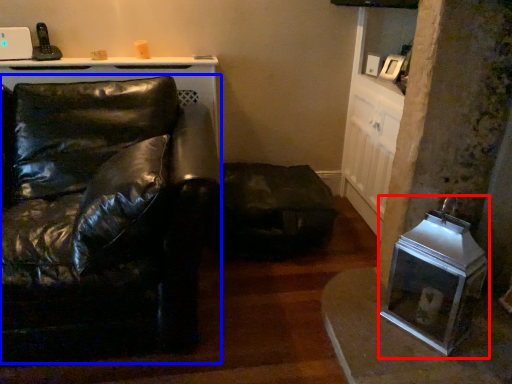
Question: Which object is closer to the camera taking this photo, appliance (highlighted by a red box) or studio couch (highlighted by a blue box)?

Choices:
 (A) appliance
 (B) studio couch

Answer: (B)